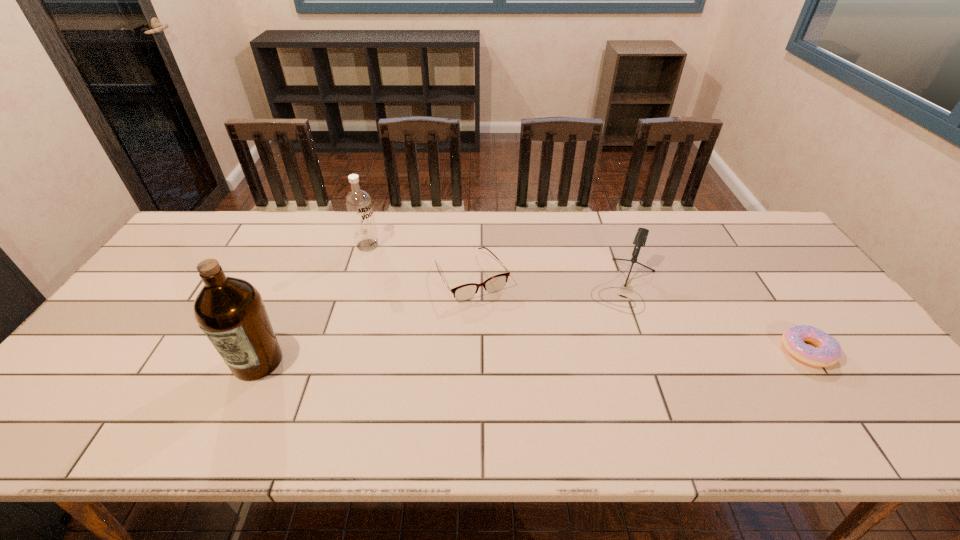
At what (x,y) coordinates should I click in order to perform the action: click on blank region between the fourth object from right to left and the doughnut. Please return your answer as a coordinate pair (x, y). The height and width of the screenshot is (540, 960). Looking at the image, I should click on (588, 298).

Point out which object is positioned as the nearest to the second object from left to right. Please provide its 2D coordinates. Your answer should be formatted as a tuple, i.e. [(x, y)], where the tuple contains the x and y coordinates of a point satisfying the conditions above.

[(465, 292)]

The width and height of the screenshot is (960, 540). I want to click on object that is the second closest to the vodka, so click(230, 311).